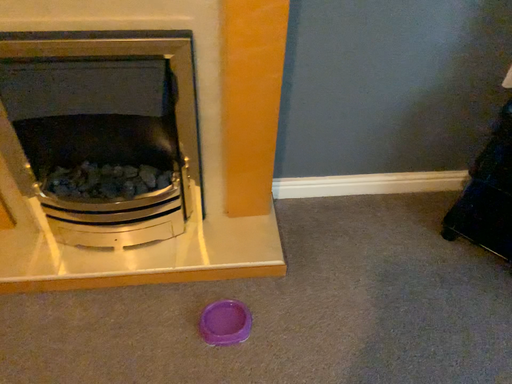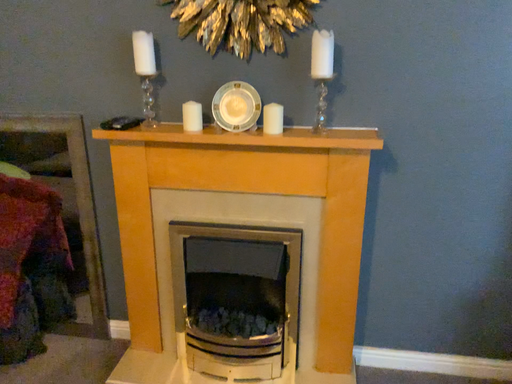
Question: How did the camera likely rotate when shooting the video?

Choices:
 (A) rotated right
 (B) rotated left

Answer: (B)